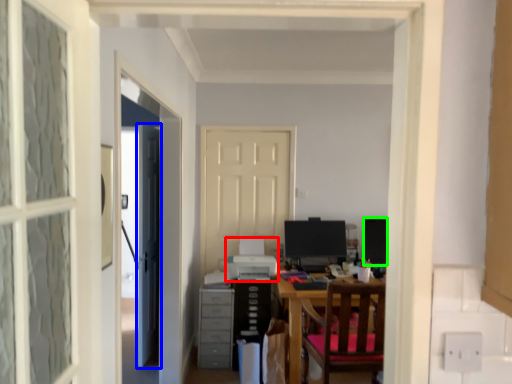
Question: Which object is positioned closest to printer (highlighted by a red box)? Select from door (highlighted by a blue box) and computer monitor (highlighted by a green box).

Choices:
 (A) door
 (B) computer monitor

Answer: (A)